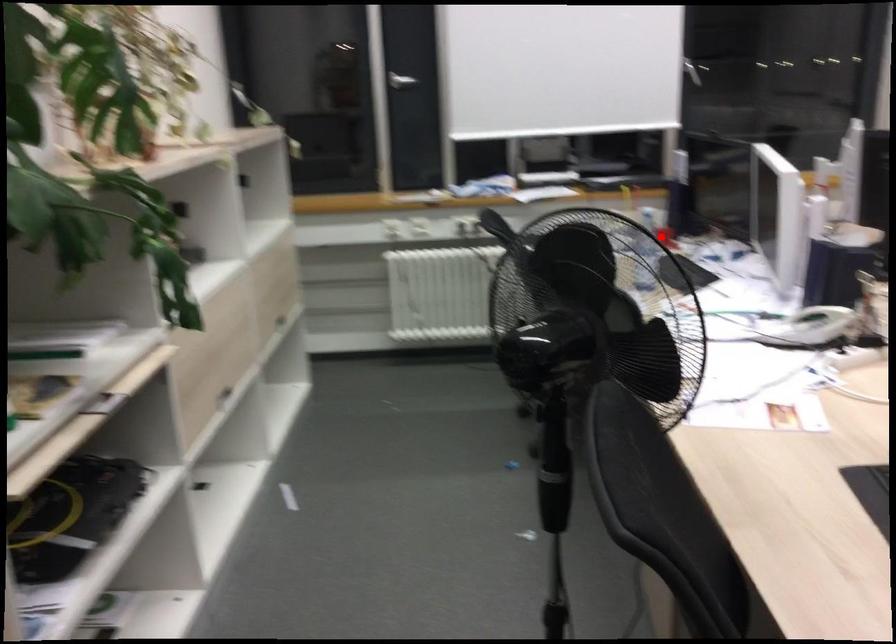
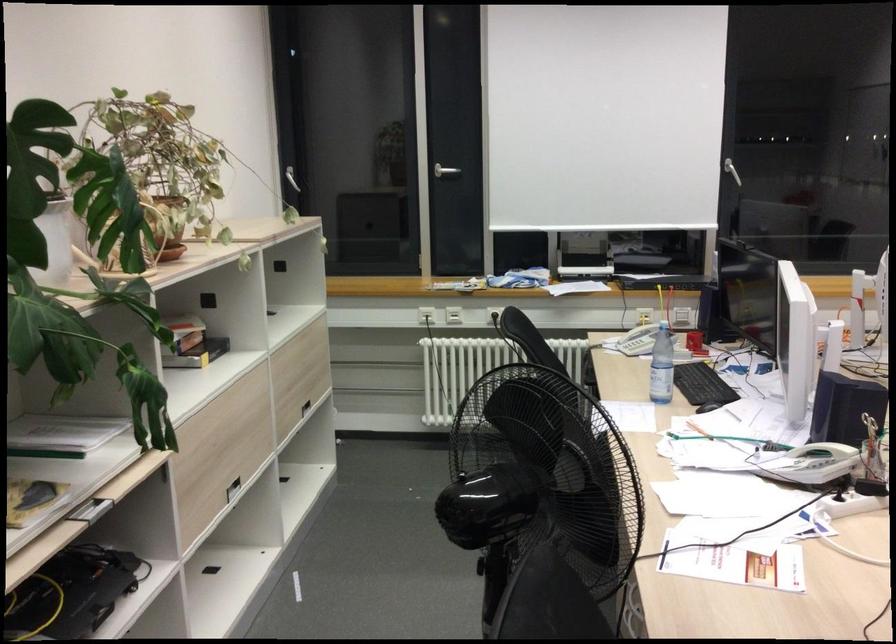
Locate, in the second image, the point that corresponds to the highlighted location in the first image.

(694, 343)